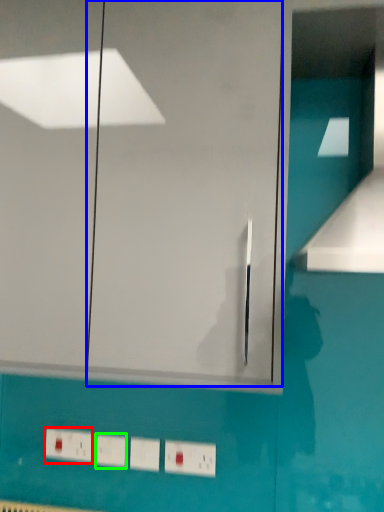
Question: Based on their relative distances, which object is nearer to electric outlet (highlighted by a red box)? Choose from glass door (highlighted by a blue box) and light switch (highlighted by a green box).

Choices:
 (A) glass door
 (B) light switch

Answer: (B)